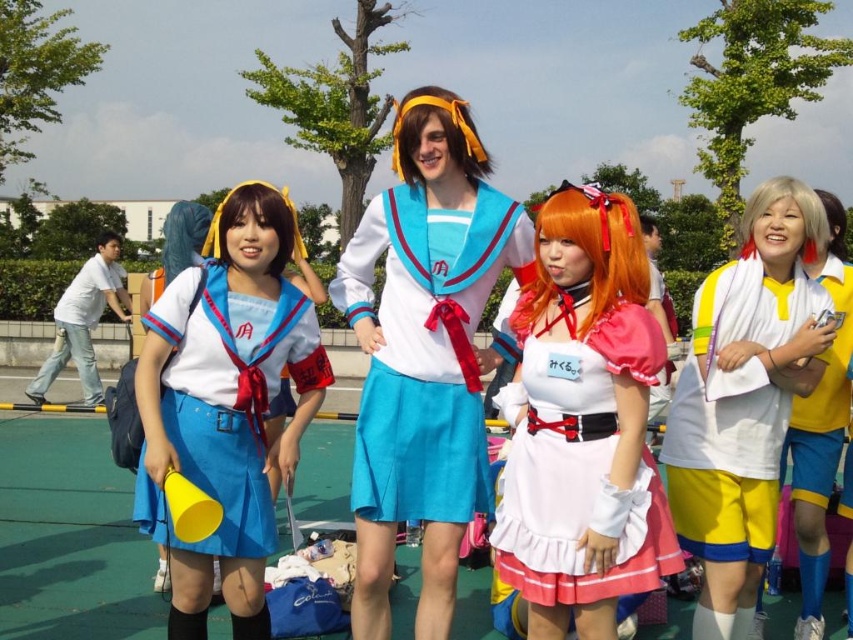
Question: Which point is farther from the camera taking this photo?

Choices:
 (A) (212, 246)
 (B) (793, 280)
 (C) (316, 330)
 (D) (563, 204)

Answer: (B)

Question: Can you confirm if yellow jersey at right is positioned to the right of yellow fabric wig at upper left?

Choices:
 (A) yes
 (B) no

Answer: (A)

Question: Which of the following is the closest to the observer?

Choices:
 (A) shiny orange wig at center
 (B) blue fabric wig at upper left
 (C) yellow fabric wig at upper left
 (D) brown matte wig at center

Answer: (A)

Question: Considering the real-world distances, which object is farthest from the yellow fabric shorts at right?

Choices:
 (A) satin blue skirt at center
 (B) brown matte wig at center
 (C) yellow fabric wig at upper left
 (D) orange synthetic wig at center

Answer: (C)

Question: Can you confirm if matte blue skirt at lower left is wider than blue fabric wig at upper left?

Choices:
 (A) no
 (B) yes

Answer: (A)

Question: From the image, what is the correct spatial relationship of pink satin dress at center in relation to white matte wig at right?

Choices:
 (A) left
 (B) right

Answer: (A)